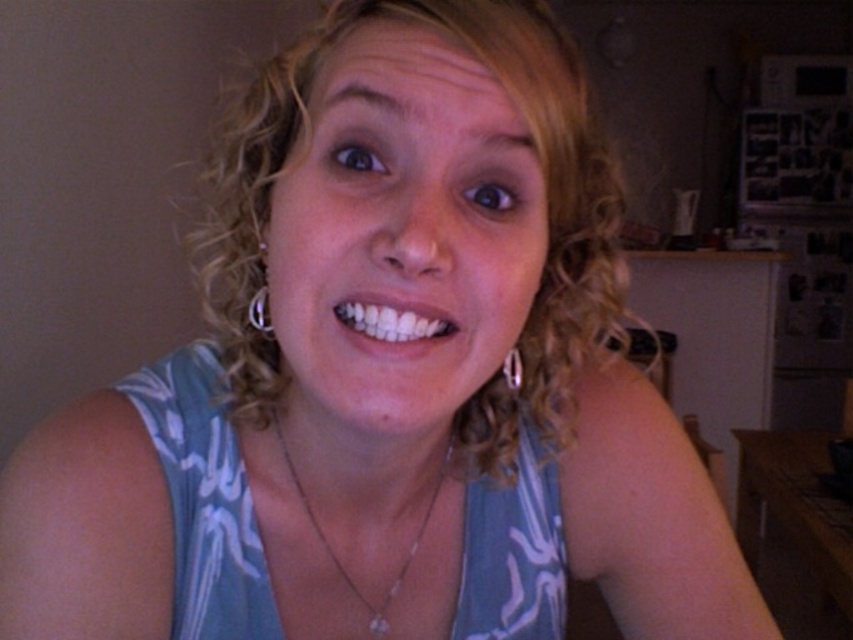
Between point (517, 497) and point (450, 456), which one is positioned behind?

The point (517, 497) is behind.

Between blue printed fabric dress at center and silver chain necklace at center, which one has less height?

With less height is silver chain necklace at center.

Is point (520, 531) farther from camera compared to point (279, 438)?

Yes, it is.

Image resolution: width=853 pixels, height=640 pixels. What are the coordinates of `blue printed fabric dress at center` in the screenshot? It's located at (206, 499).

Is white glossy teeth at center thinner than silver chain necklace at center?

Yes, white glossy teeth at center is thinner than silver chain necklace at center.

Is point (407, 307) closer to viewer compared to point (339, 563)?

Yes, point (407, 307) is closer to viewer.

What are the coordinates of `white glossy teeth at center` in the screenshot? It's located at (392, 320).

Which is more to the right, curly blonde hair at center or white glossy teeth at center?

From the viewer's perspective, white glossy teeth at center appears more on the right side.

Does curly blonde hair at center have a greater height compared to white glossy teeth at center?

Yes.

The height and width of the screenshot is (640, 853). I want to click on curly blonde hair at center, so click(x=546, y=218).

Image resolution: width=853 pixels, height=640 pixels. I want to click on curly blonde hair at center, so click(x=546, y=218).